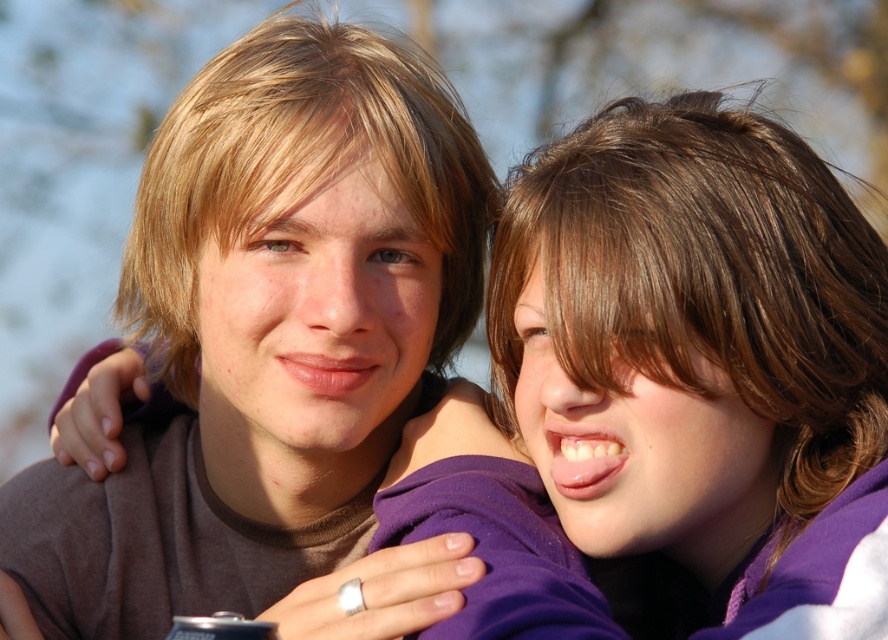
Which is more to the right, matte brown hair at center or purple fabric at upper right?

Positioned to the right is purple fabric at upper right.

Does matte brown hair at center appear on the left side of purple fabric at upper right?

Yes, matte brown hair at center is to the left of purple fabric at upper right.

Between point (400, 358) and point (716, 280), which one is positioned in front?

Point (716, 280) is in front.

This screenshot has width=888, height=640. I want to click on matte brown hair at center, so click(267, 332).